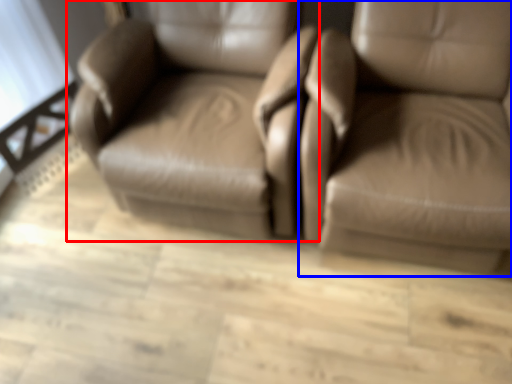
Question: Which object is closer to the camera taking this photo, chair (highlighted by a red box) or chair (highlighted by a blue box)?

Choices:
 (A) chair
 (B) chair

Answer: (B)